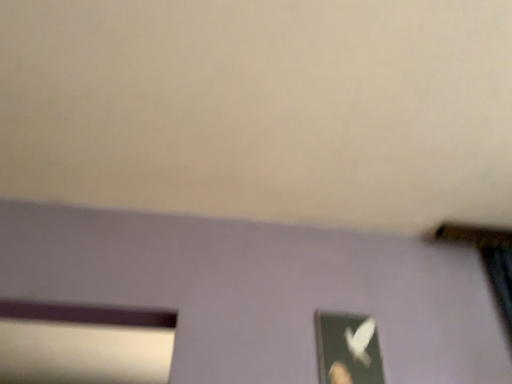
This screenshot has width=512, height=384. In order to click on white matte window screen at lower right in this screenshot , I will do `click(348, 349)`.

What do you see at coordinates (348, 349) in the screenshot? I see `white matte window screen at lower right` at bounding box center [348, 349].

What is the approximate width of white matte window screen at lower right?

white matte window screen at lower right is 3.18 centimeters wide.

This screenshot has height=384, width=512. Identify the location of white matte window screen at lower right. (348, 349).